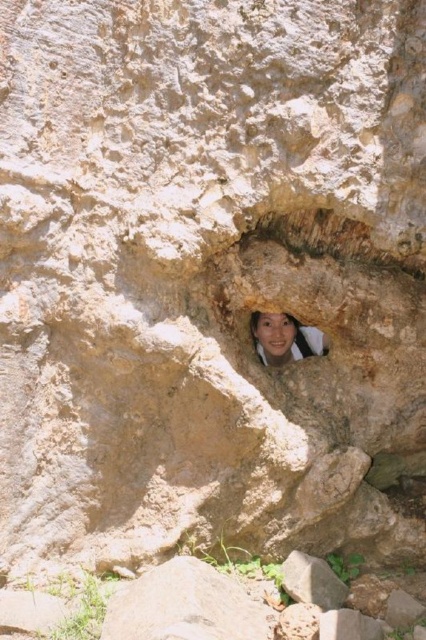
The height and width of the screenshot is (640, 426). I want to click on smooth beige face at center, so click(x=284, y=339).

How far apart are smooth beige face at center and gray rough rock at center?

They are 22.22 inches apart.

Which is behind, point (296, 339) or point (314, 580)?

The point (296, 339) is more distant.

Find the location of a particular element. The width and height of the screenshot is (426, 640). smooth beige face at center is located at coordinates (284, 339).